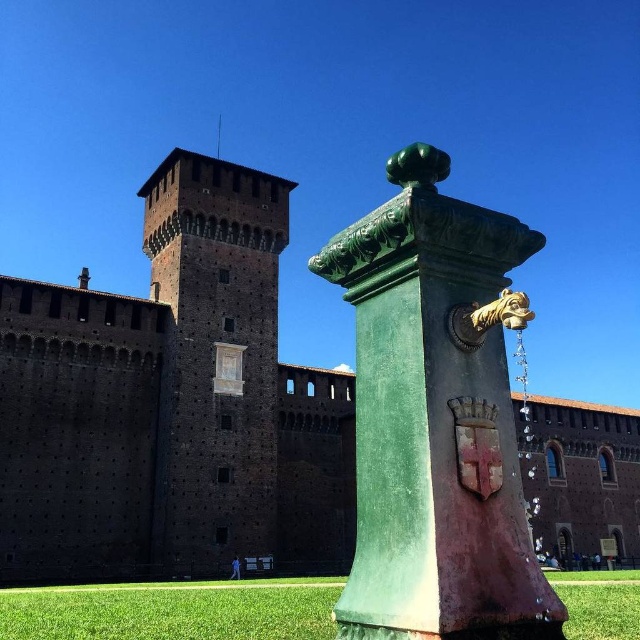
Does green glazed fountain at center have a smaller size compared to green patinated metal fountain at center?

Incorrect, green glazed fountain at center is not smaller in size than green patinated metal fountain at center.

Measure the distance from green glazed fountain at center to green patinated metal fountain at center.

They are 19.98 meters apart.

This screenshot has width=640, height=640. What do you see at coordinates (172, 404) in the screenshot?
I see `green glazed fountain at center` at bounding box center [172, 404].

Where is `green glazed fountain at center`? This screenshot has width=640, height=640. green glazed fountain at center is located at coordinates (172, 404).

Does dark brown stone tower at center have a greater height compared to green grass at lower center?

Correct, dark brown stone tower at center is much taller as green grass at lower center.

Does dark brown stone tower at center have a larger size compared to green grass at lower center?

No.

Describe the element at coordinates (214, 356) in the screenshot. This screenshot has width=640, height=640. I see `dark brown stone tower at center` at that location.

Identify the location of dark brown stone tower at center. The height and width of the screenshot is (640, 640). (214, 356).

How much distance is there between green glazed fountain at center and green grass at lower center?

green glazed fountain at center and green grass at lower center are 17.47 meters apart.

Can you confirm if green glazed fountain at center is positioned to the right of green grass at lower center?

Indeed, green glazed fountain at center is positioned on the right side of green grass at lower center.

The image size is (640, 640). Describe the element at coordinates (172, 404) in the screenshot. I see `green glazed fountain at center` at that location.

Identify the location of green glazed fountain at center. The image size is (640, 640). (172, 404).